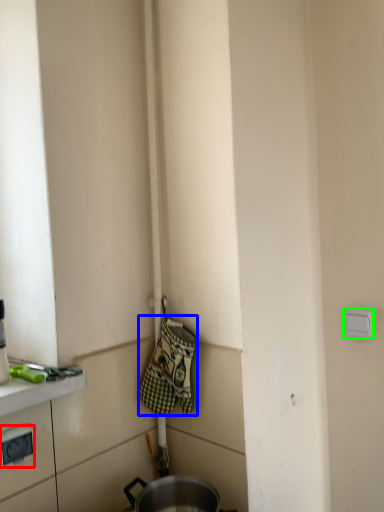
Question: Considering the real-world distances, which object is farthest from electric outlet (highlighted by a red box)? blanket (highlighted by a blue box) or electric outlet (highlighted by a green box)?

Choices:
 (A) blanket
 (B) electric outlet

Answer: (B)